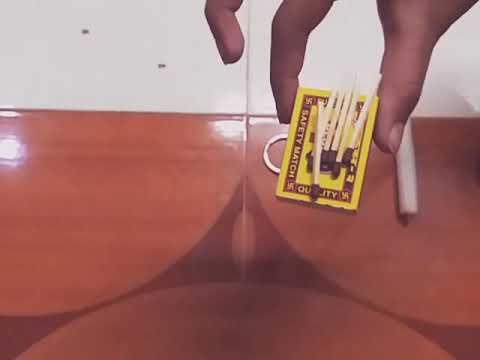
Image resolution: width=480 pixels, height=360 pixels. Find the location of `box of matches`. box of matches is located at coordinates (298, 98).